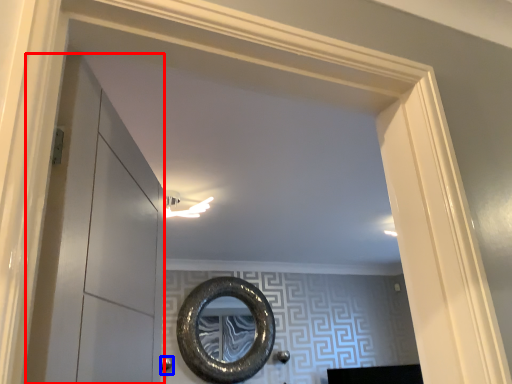
Question: Which point is closer to the camera, glass door (highlighted by a red box) or door handle (highlighted by a blue box)?

Choices:
 (A) glass door
 (B) door handle

Answer: (A)